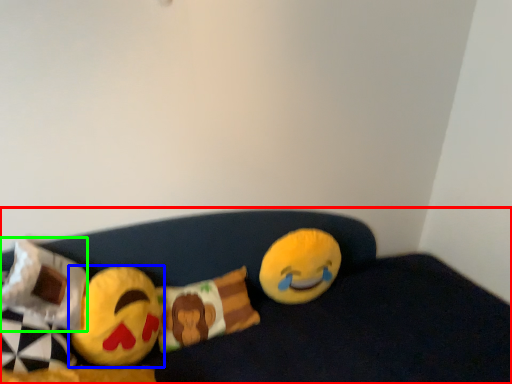
Question: Which object is positioned closest to furniture (highlighted by a red box)? Select from toy (highlighted by a blue box) and pillow (highlighted by a green box).

Choices:
 (A) toy
 (B) pillow

Answer: (A)